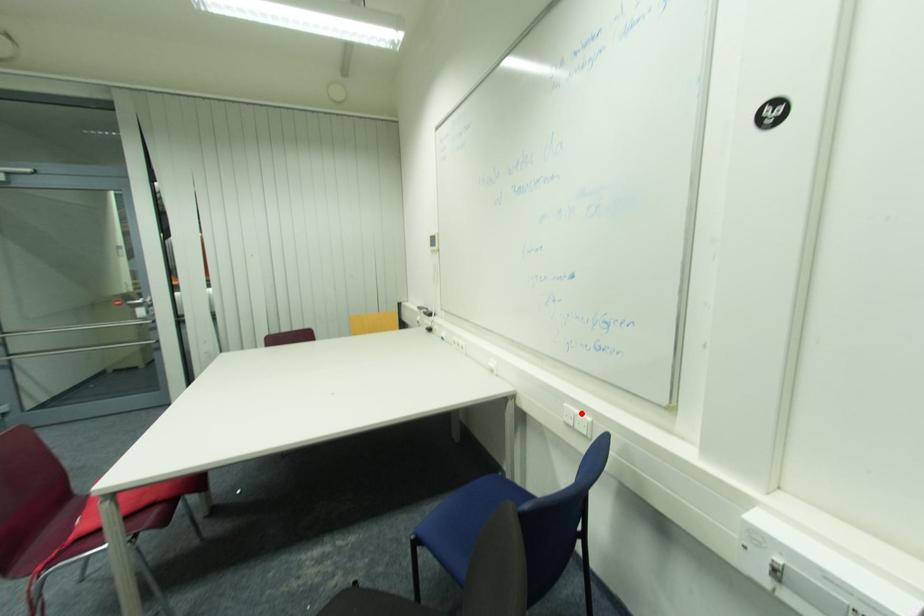
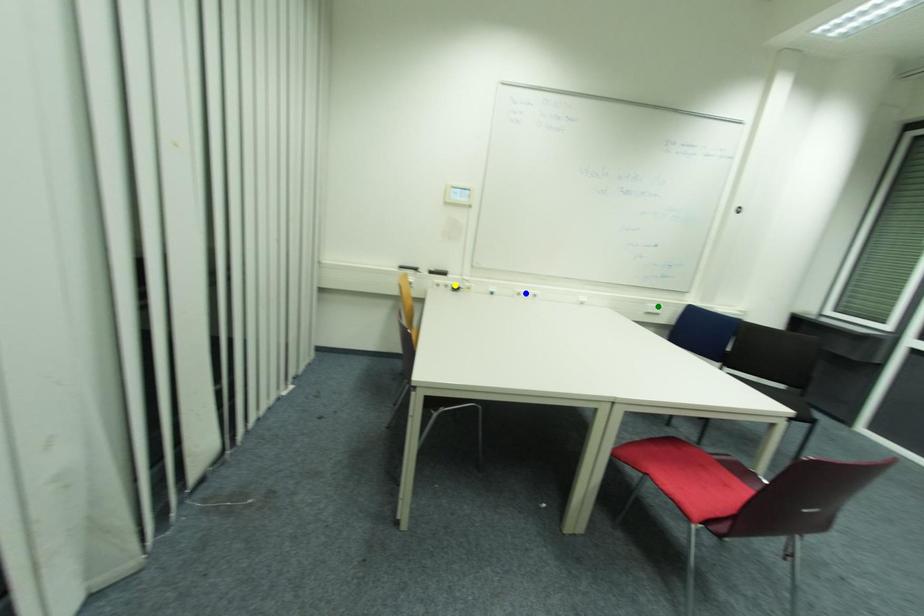
Question: I am providing you with two images of the same scene from different viewpoints. A red point is marked on the first image. You are given multiple points on the second image. Which spot in image 2 lines up with the point in image 1?

Choices:
 (A) yellow point
 (B) blue point
 (C) green point

Answer: (C)